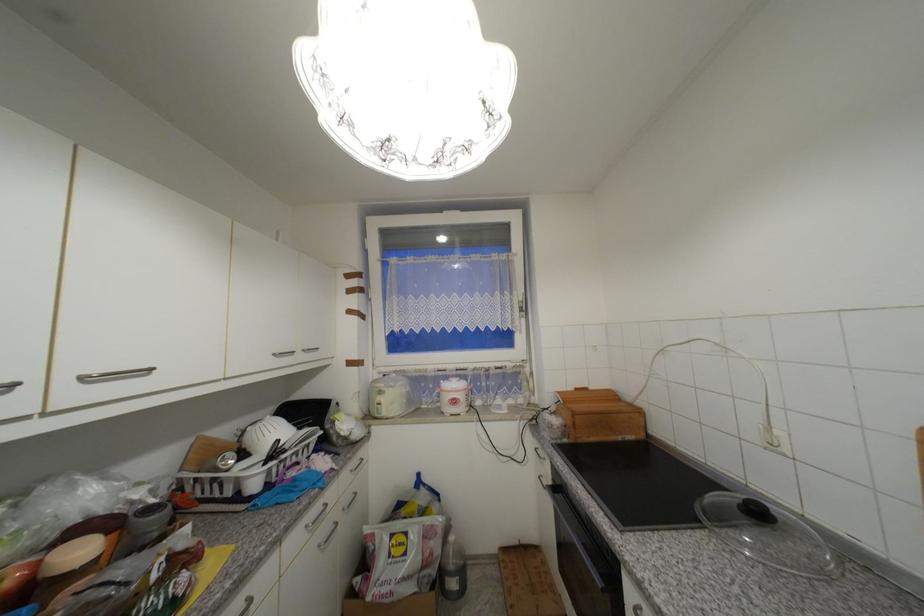
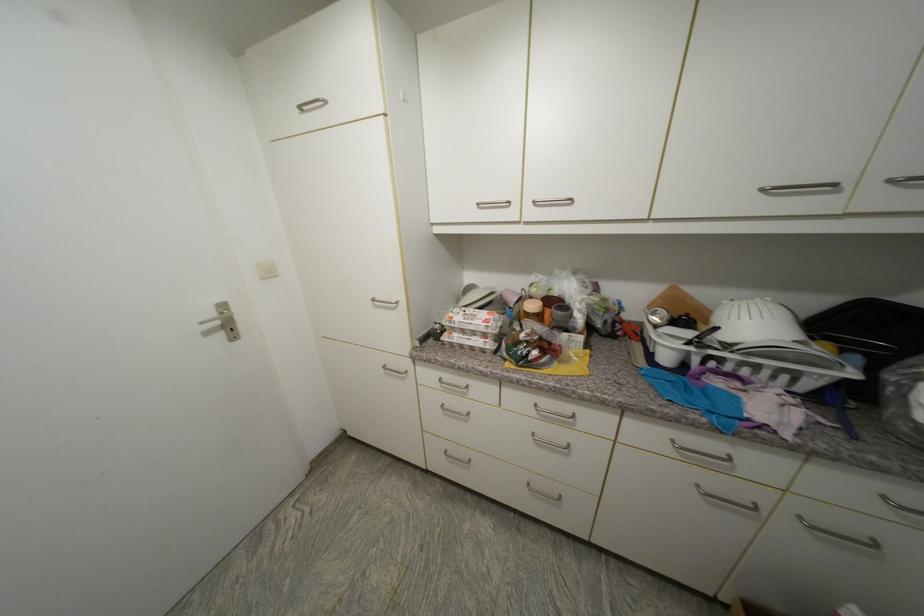
Find the pixel in the second image that matches the point at 281,355 in the first image.

(768, 191)